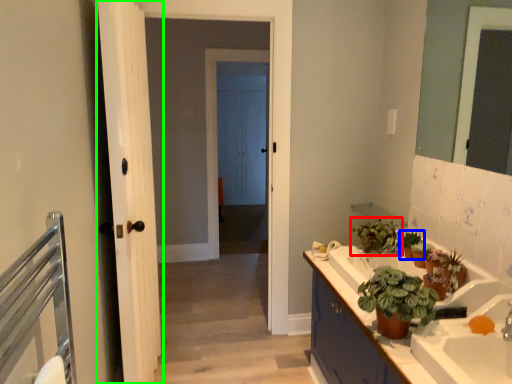
Question: Which is nearer to the houseplant (highlighted by a red box)? houseplant (highlighted by a blue box) or door (highlighted by a green box).

Choices:
 (A) houseplant
 (B) door

Answer: (A)